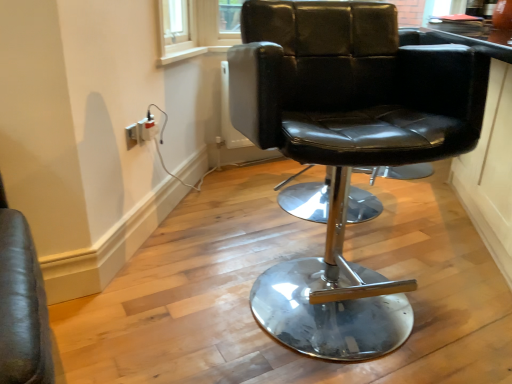
Question: Is black leather chair at center to the left or to the right of white plastic socket at lower left, acting as the 2th electric outlet starting from the front, in the image?

Choices:
 (A) left
 (B) right

Answer: (B)

Question: Is black leather chair at center inside the boundaries of white plastic socket at lower left, the 1th electric outlet in the right-to-left sequence, or outside?

Choices:
 (A) inside
 (B) outside

Answer: (B)

Question: Which object is the closest to the white plastic electric outlet at lower left, the 1th electric outlet from the front?

Choices:
 (A) white plastic socket at lower left, the 1th electric outlet from the back
 (B) black leather chair at center

Answer: (A)

Question: Based on their relative distances, which object is farther from the black leather chair at center?

Choices:
 (A) white plastic socket at lower left, positioned as the second electric outlet in left-to-right order
 (B) white plastic electric outlet at lower left, placed as the 2th electric outlet when sorted from right to left

Answer: (A)